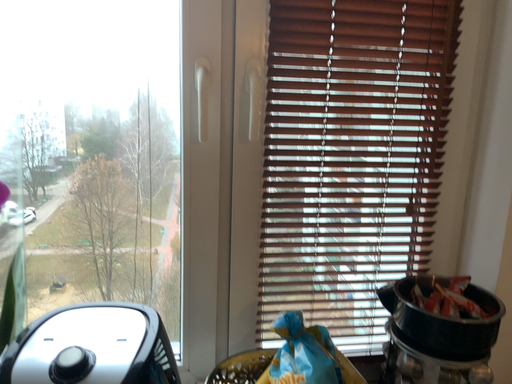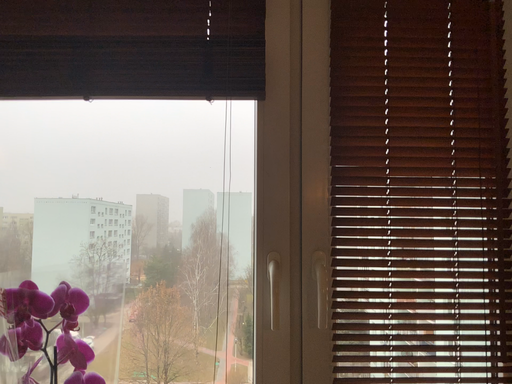
Question: Which way did the camera rotate in the video?

Choices:
 (A) rotated upward
 (B) rotated downward

Answer: (A)